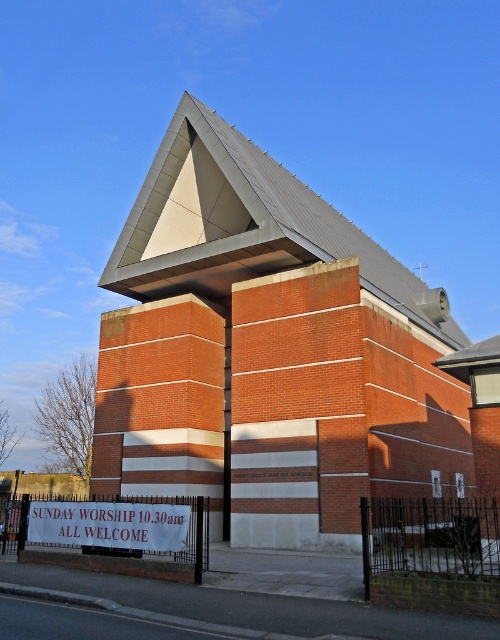
Does point (190, 472) lie in front of point (184, 524)?

No, it is behind (184, 524).

Who is positioned more to the left, brick chapel at center or white fabric sign at lower center?

From the viewer's perspective, white fabric sign at lower center appears more on the left side.

Who is more distant from viewer, (424, 397) or (105, 525)?

Positioned behind is point (424, 397).

You are a GUI agent. You are given a task and a screenshot of the screen. Output one action in this format:
    pyautogui.click(x=<x>, y=<y>)
    Task: Click on the brick chapel at center
    The width and height of the screenshot is (500, 640).
    Given the screenshot: What is the action you would take?
    pyautogui.click(x=269, y=353)